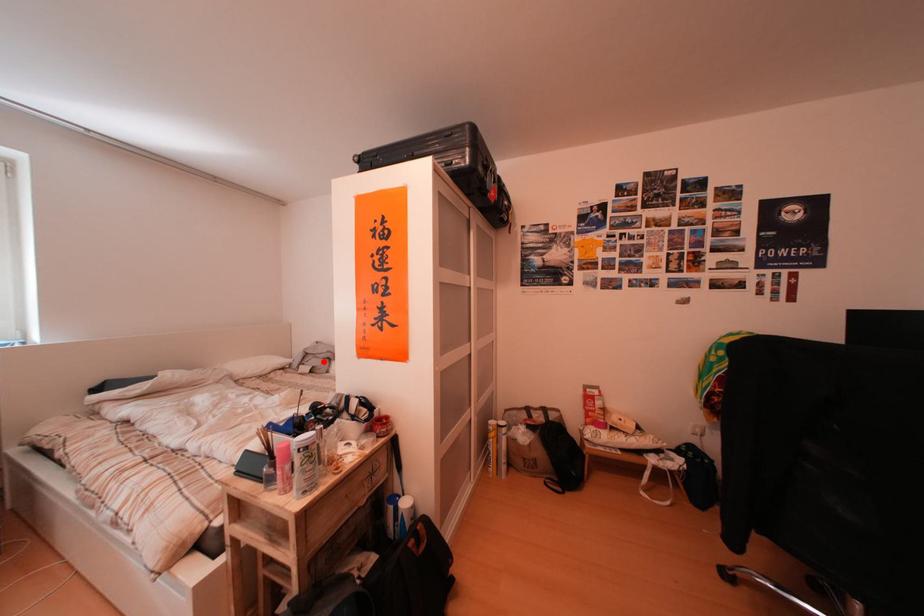
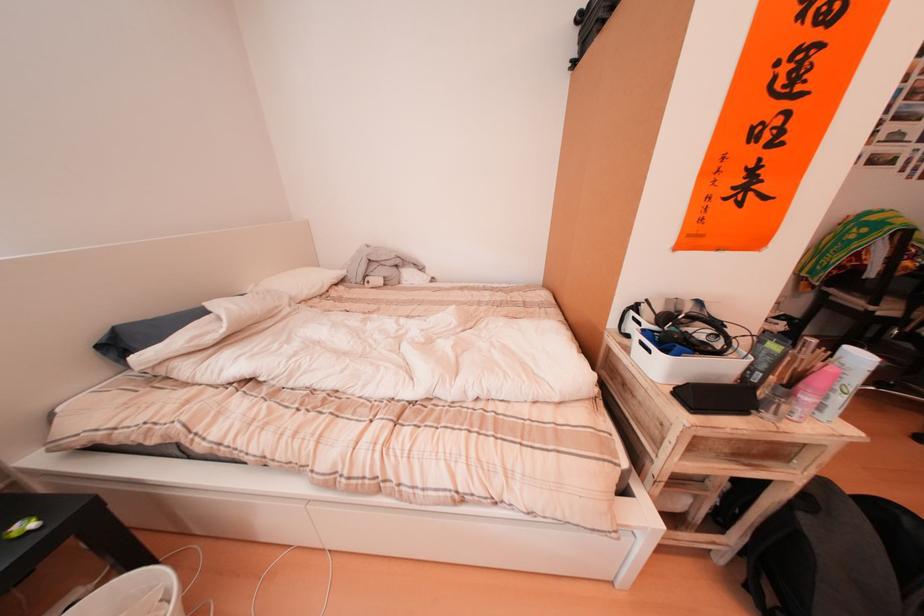
Question: I am providing you with two images of the same scene from different viewpoints. In image1, a red point is highlighted. Considering the same 3D point in image2, which of the following is correct?

Choices:
 (A) It is closer
 (B) It is farther

Answer: (A)